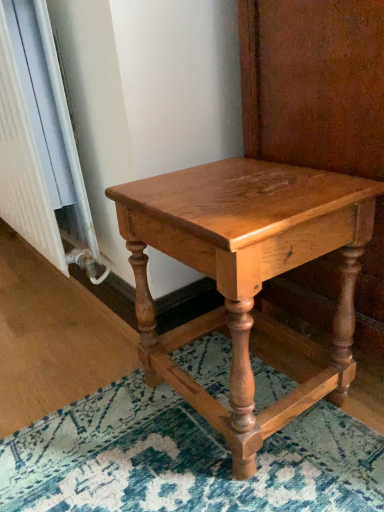
The width and height of the screenshot is (384, 512). What do you see at coordinates (246, 274) in the screenshot?
I see `shiny oak table at center` at bounding box center [246, 274].

Where is `shiny oak table at center`? The width and height of the screenshot is (384, 512). shiny oak table at center is located at coordinates (246, 274).

The image size is (384, 512). What do you see at coordinates (23, 163) in the screenshot?
I see `white textured radiator at left` at bounding box center [23, 163].

Locate an element on the screen. white textured radiator at left is located at coordinates (23, 163).

Identify the location of shiny oak table at center. Image resolution: width=384 pixels, height=512 pixels. (246, 274).

Visually, is white textured radiator at left positioned to the left or to the right of shiny oak table at center?

Clearly, white textured radiator at left is on the left of shiny oak table at center in the image.

In the image, is white textured radiator at left positioned in front of or behind shiny oak table at center?

white textured radiator at left is behind shiny oak table at center.

Is point (14, 222) farther from viewer compared to point (256, 260)?

That is True.

From the image's perspective, is white textured radiator at left located above shiny oak table at center?

Yes, from the image's perspective, white textured radiator at left is above shiny oak table at center.

From a real-world perspective, is white textured radiator at left above or below shiny oak table at center?

white textured radiator at left is above shiny oak table at center.

Is white textured radiator at left wider than shiny oak table at center?

Incorrect, the width of white textured radiator at left does not surpass that of shiny oak table at center.

Who is shorter, white textured radiator at left or shiny oak table at center?

shiny oak table at center.

Is white textured radiator at left bigger than shiny oak table at center?

Correct, white textured radiator at left is larger in size than shiny oak table at center.

Is white textured radiator at left positioned beyond the bounds of shiny oak table at center?

That's correct, white textured radiator at left is outside of shiny oak table at center.

Is the surface of white textured radiator at left in direct contact with shiny oak table at center?

No.

Is white textured radiator at left oriented towards shiny oak table at center?

No.

How many degrees apart are the facing directions of white textured radiator at left and shiny oak table at center?

They differ by 88.7 degrees in their facing directions.

How distant is white textured radiator at left from shiny oak table at center?

The distance of white textured radiator at left from shiny oak table at center is 43.12 centimeters.

You are a GUI agent. You are given a task and a screenshot of the screen. Output one action in this format:
    pyautogui.click(x=<x>, y=<y>)
    Task: Click on the radiator above the shiny oak table at center (from the image's perspective)
    
    Given the screenshot: What is the action you would take?
    pyautogui.click(x=23, y=163)

From the picture: Considering the positions of objects shiny oak table at center and white textured radiator at left in the image provided, who is more to the left, shiny oak table at center or white textured radiator at left?

Positioned to the left is white textured radiator at left.

From the picture: Is shiny oak table at center in front of or behind white textured radiator at left in the image?

Visually, shiny oak table at center is located in front of white textured radiator at left.

Considering the points (334, 337) and (22, 190), which point is behind, point (334, 337) or point (22, 190)?

The point (22, 190) is more distant.

Based on the photo, from the image's perspective, is shiny oak table at center below white textured radiator at left?

Yes, from the image's perspective, shiny oak table at center is below white textured radiator at left.

From a real-world perspective, is shiny oak table at center positioned above or below white textured radiator at left?

shiny oak table at center is below white textured radiator at left.

Looking at this image, is shiny oak table at center wider than white textured radiator at left?

Indeed, shiny oak table at center has a greater width compared to white textured radiator at left.

Considering the sizes of objects shiny oak table at center and white textured radiator at left in the image provided, who is taller, shiny oak table at center or white textured radiator at left?

white textured radiator at left is taller.

Does shiny oak table at center have a larger size compared to white textured radiator at left?

Incorrect, shiny oak table at center is not larger than white textured radiator at left.

Is white textured radiator at left located within shiny oak table at center?

No, white textured radiator at left is not a part of shiny oak table at center.

Are shiny oak table at center and white textured radiator at left located far from each other?

No, shiny oak table at center is not far away from white textured radiator at left.

Is shiny oak table at center turned away from white textured radiator at left?

Yes, shiny oak table at center's orientation is away from white textured radiator at left.

This screenshot has width=384, height=512. What are the coordinates of `table below the white textured radiator at left (from a real-world perspective)` in the screenshot? It's located at (246, 274).

The width and height of the screenshot is (384, 512). I want to click on table directly beneath the white textured radiator at left (from a real-world perspective), so click(246, 274).

At what (x,y) coordinates should I click in order to perform the action: click on table located below the white textured radiator at left (from the image's perspective). Please return your answer as a coordinate pair (x, y). The width and height of the screenshot is (384, 512). Looking at the image, I should click on (246, 274).